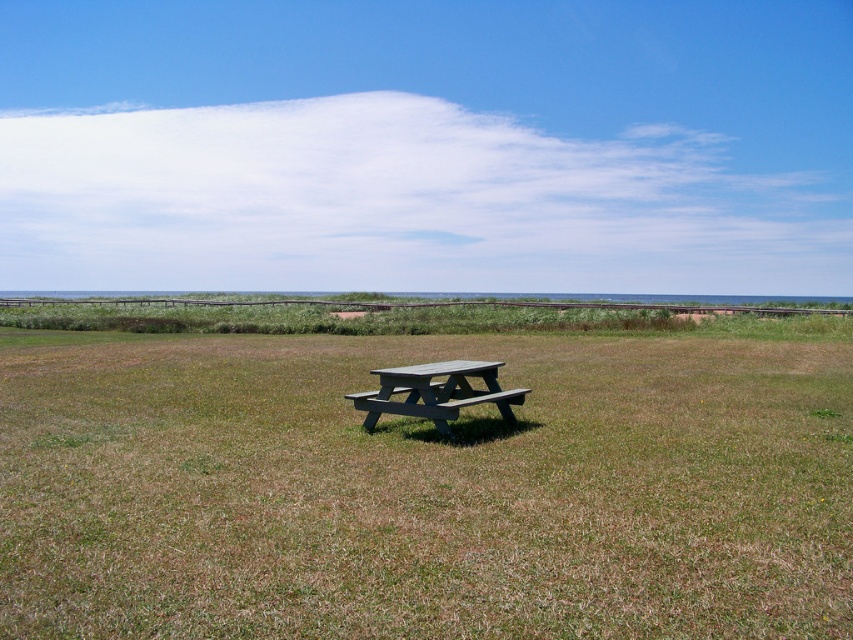
Does green grass at center appear over gray wood picnic table at center?

No, green grass at center is not above gray wood picnic table at center.

Find the location of a particular element. Image resolution: width=853 pixels, height=640 pixels. green grass at center is located at coordinates (424, 488).